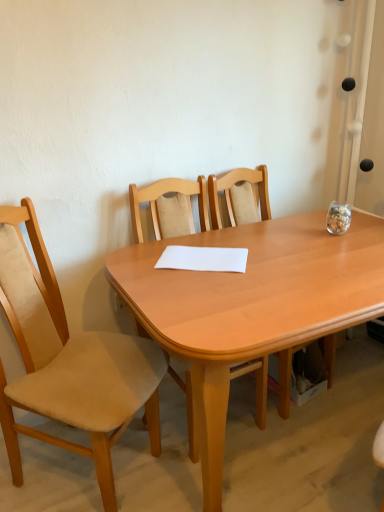
You are a GUI agent. You are given a task and a screenshot of the screen. Output one action in this format:
    pyautogui.click(x=<x>, y=<y>)
    Task: Click on the vacant area on top of light wood table at center (from a real-world perspective)
    This screenshot has height=512, width=384.
    Given the screenshot: What is the action you would take?
    pyautogui.click(x=276, y=258)